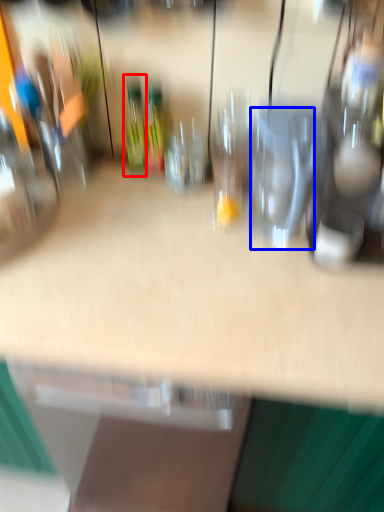
Question: Which object is closer to the camera taking this photo, bottle (highlighted by a red box) or wine glass (highlighted by a blue box)?

Choices:
 (A) bottle
 (B) wine glass

Answer: (B)